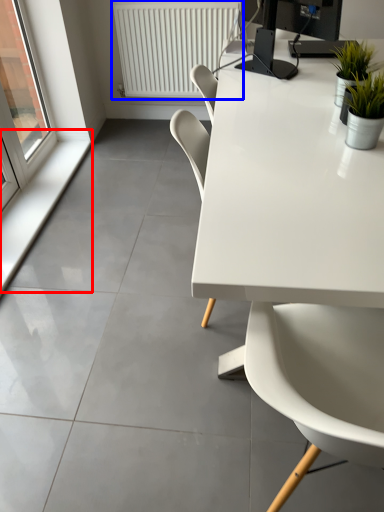
Question: Which object is further to the camera taking this photo, window sill (highlighted by a red box) or radiator (highlighted by a blue box)?

Choices:
 (A) window sill
 (B) radiator

Answer: (B)